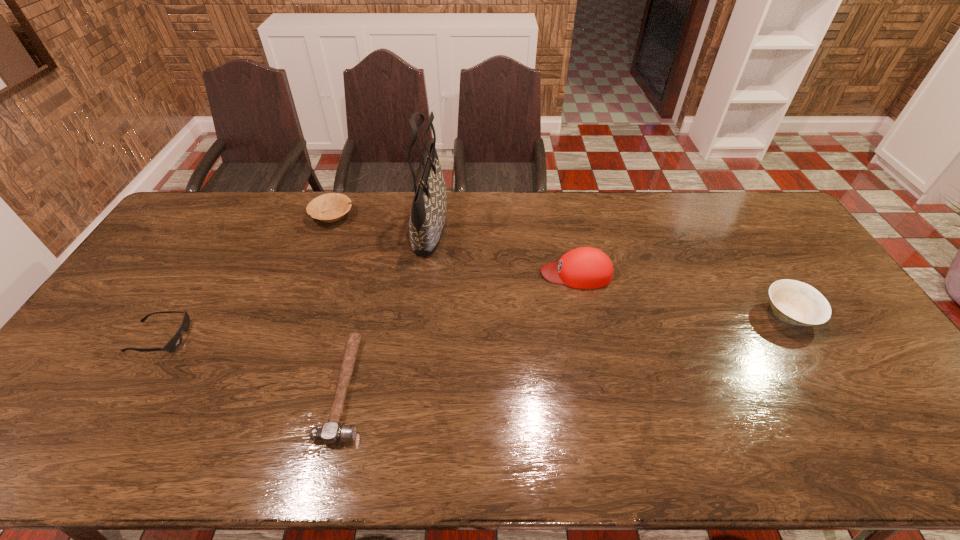
Identify the location of the closest object to the second tallest object. (427, 219).

Find the location of `free location that satisfies the following two spatial constraints: 1. on the front side of the third shortest object; 2. on the left side of the third tallest object`. free location that satisfies the following two spatial constraints: 1. on the front side of the third shortest object; 2. on the left side of the third tallest object is located at coordinates (295, 315).

The image size is (960, 540). What are the coordinates of `blank space that satisfies the following two spatial constraints: 1. on the front side of the farther bowl; 2. on the front-facing side of the sunglasses` in the screenshot? It's located at (286, 338).